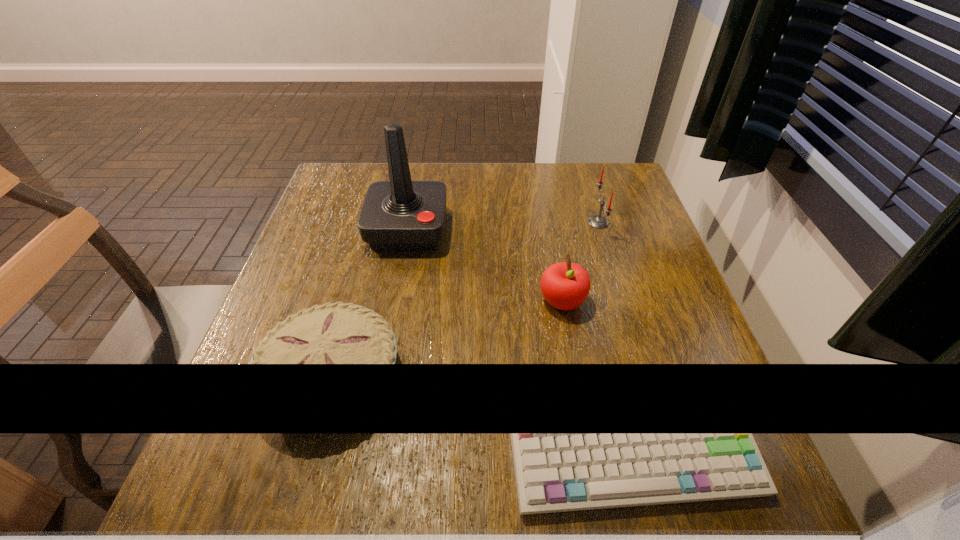
Identify the location of free region at the near edge. (500, 489).

The height and width of the screenshot is (540, 960). Find the location of `vacant space at the left edge`. vacant space at the left edge is located at coordinates (312, 215).

This screenshot has height=540, width=960. I want to click on vacant position at the right edge of the desktop, so click(x=649, y=300).

Image resolution: width=960 pixels, height=540 pixels. Find the location of `vacant space at the far left corner of the desktop`. vacant space at the far left corner of the desktop is located at coordinates (383, 163).

Where is `vacant space at the near left corner of the desktop`? vacant space at the near left corner of the desktop is located at coordinates (252, 516).

Where is `vacant space that's between the second nearest object and the pie`? The height and width of the screenshot is (540, 960). vacant space that's between the second nearest object and the pie is located at coordinates (446, 338).

The image size is (960, 540). I want to click on empty space that is in between the third object from left to right and the rightmost object, so click(x=580, y=262).

Find the location of a particular element. The width and height of the screenshot is (960, 540). empty location between the apple and the candle is located at coordinates (580, 262).

At what (x,y) coordinates should I click in order to perform the action: click on free space between the pie and the rightmost object. Please return your answer as a coordinate pair (x, y). The height and width of the screenshot is (540, 960). Looking at the image, I should click on (465, 299).

The image size is (960, 540). I want to click on vacant space that is in between the shortest object and the apple, so click(x=446, y=338).